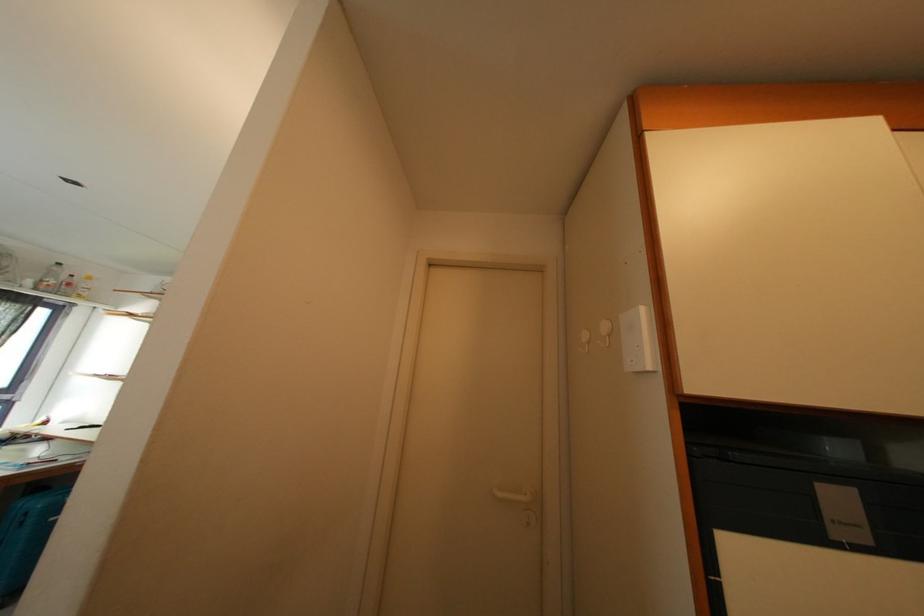
Image resolution: width=924 pixels, height=616 pixels. I want to click on white panel button, so click(637, 341).